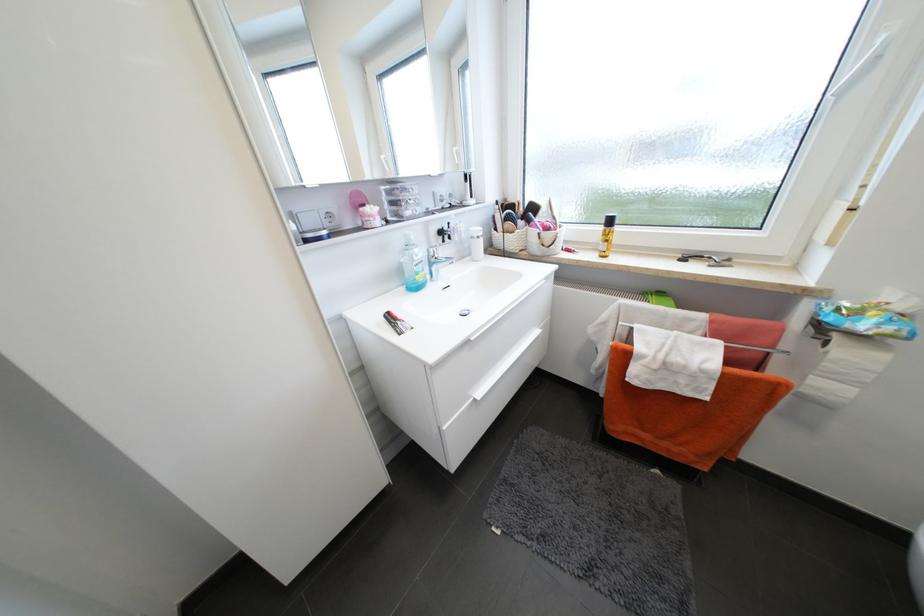
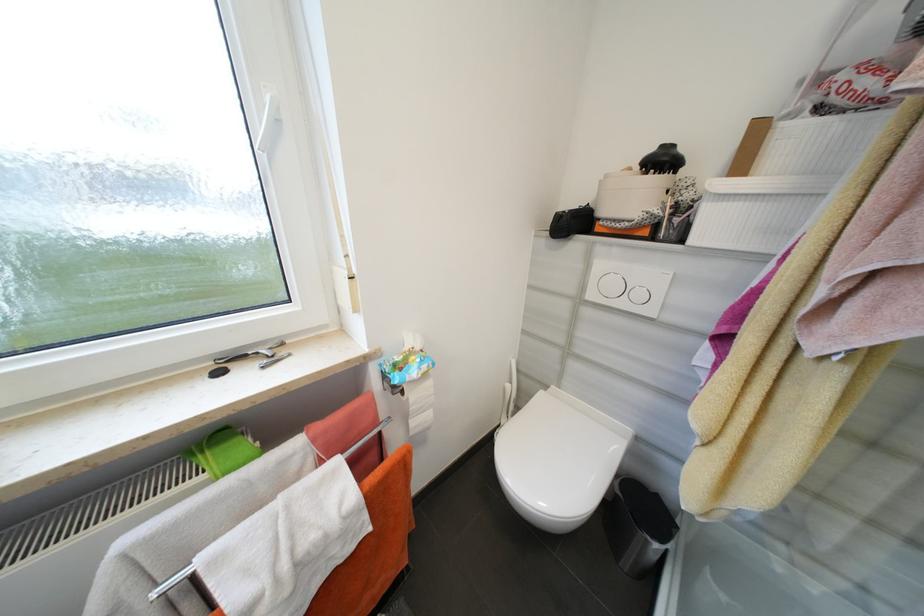
Question: How did the camera likely rotate?

Choices:
 (A) Left
 (B) Right
 (C) Up
 (D) Down

Answer: (B)